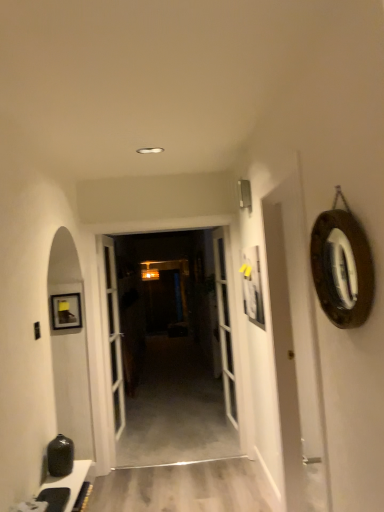
The width and height of the screenshot is (384, 512). Describe the element at coordinates (342, 268) in the screenshot. I see `wooden-framed mirror at right` at that location.

Describe the element at coordinates (70, 481) in the screenshot. I see `matte black cabinet at lower left` at that location.

Find the location of a particular element. wooden at center is located at coordinates (173, 347).

Which object is further away from the camera, white glass door at center, the first door viewed from the right, or wooden-framed mirror at right?

Positioned behind is white glass door at center, the first door viewed from the right.

From a real-world perspective, between white glass door at center, the first door viewed from the right, and wooden-framed mirror at right, who is vertically higher?

wooden-framed mirror at right.

Which of these two, white glass door at center, the first door viewed from the right, or wooden-framed mirror at right, is wider?

white glass door at center, the first door viewed from the right, is wider.

Would you say wooden-framed mirror at right is part of white glass door at center, the first door viewed from the right,'s contents?

Definitely not — wooden-framed mirror at right is not inside white glass door at center, the first door viewed from the right.

Does wooden-framed mirror at right have a greater width compared to white glass door at center, acting as the second door starting from the left?

No.

Is wooden-framed mirror at right smaller than white glass door at center, acting as the second door starting from the left?

Yes, wooden-framed mirror at right is smaller than white glass door at center, acting as the second door starting from the left.

Who is taller, wooden-framed mirror at right or white glass door at center, the first door viewed from the right?

With more height is white glass door at center, the first door viewed from the right.

From the image's perspective, is wooden-framed mirror at right on top of white glass door at center, the first door viewed from the right?

Yes, from the image's perspective, wooden-framed mirror at right is over white glass door at center, the first door viewed from the right.

Is matte black cabinet at lower left next to wooden-framed mirror at right?

There is a gap between matte black cabinet at lower left and wooden-framed mirror at right.

Is matte black cabinet at lower left inside the boundaries of wooden-framed mirror at right, or outside?

matte black cabinet at lower left is located beyond the bounds of wooden-framed mirror at right.

From the picture: Who is bigger, matte black cabinet at lower left or wooden-framed mirror at right?

Bigger between the two is wooden-framed mirror at right.

Is matte black cabinet at lower left facing towards wooden-framed mirror at right?

No, matte black cabinet at lower left is not oriented towards wooden-framed mirror at right.

Can white glass door at center, the first door viewed from the right, be found inside wooden at center?

No, white glass door at center, the first door viewed from the right, is not a part of wooden at center.

From the image's perspective, is wooden at center under white glass door at center, the first door viewed from the right?

Yes.

Can you tell me how much wooden at center and white glass door at center, the first door viewed from the right, differ in facing direction?

They differ by 0.00151 degrees in their facing directions.

Between wooden at center and white glass door at center, acting as the second door starting from the left, which one has smaller size?

Smaller between the two is wooden at center.

From a real-world perspective, which is physically above, wooden at center or wooden-framed mirror at right?

wooden-framed mirror at right.

In the image, is wooden at center positioned in front of or behind wooden-framed mirror at right?

wooden at center is positioned farther from the viewer than wooden-framed mirror at right.

In the scene shown: In terms of width, does wooden at center look wider or thinner when compared to wooden-framed mirror at right?

Considering their sizes, wooden at center looks slimmer than wooden-framed mirror at right.

From a real-world perspective, is white glass door at center, acting as the second door starting from the left, physically located above or below matte black cabinet at lower left?

white glass door at center, acting as the second door starting from the left, is above matte black cabinet at lower left.

Consider the image. Choose the correct answer: Is white glass door at center, the first door viewed from the right, inside matte black cabinet at lower left or outside it?

white glass door at center, the first door viewed from the right, exists outside the volume of matte black cabinet at lower left.

Based on the photo, considering the sizes of objects white glass door at center, acting as the second door starting from the left, and matte black cabinet at lower left in the image provided, who is thinner, white glass door at center, acting as the second door starting from the left, or matte black cabinet at lower left?

With smaller width is matte black cabinet at lower left.

Considering the points (227, 361) and (80, 487), which point is in front, point (227, 361) or point (80, 487)?

Positioned in front is point (80, 487).

Based on the photo, is wooden-framed mirror at right not near wooden at center?

Yes, wooden-framed mirror at right and wooden at center are located far from each other.

Between wooden-framed mirror at right and wooden at center, which one has less height?

wooden-framed mirror at right is shorter.

Is wooden-framed mirror at right in front of or behind wooden at center in the image?

In the image, wooden-framed mirror at right appears in front of wooden at center.

Choose the correct answer: Is wooden-framed mirror at right inside wooden at center or outside it?

wooden-framed mirror at right is spatially situated outside wooden at center.

At what (x,y) coordinates should I click in order to perform the action: click on the 2nd door behind the wooden-framed mirror at right. Please return your answer as a coordinate pair (x, y). Looking at the image, I should click on (225, 321).

I want to click on the 2nd door below the wooden-framed mirror at right (from a real-world perspective), so click(225, 321).

Looking at the image, which one is located closer to matte black cabinet at lower left, wooden at center or wooden-framed mirror at right?

wooden-framed mirror at right.

Based on their spatial positions, is wooden at center or white glossy door at center, arranged as the first door when viewed from the left, closer to matte black cabinet at lower left?

Result: Based on the image, white glossy door at center, arranged as the first door when viewed from the left, appears to be nearer to matte black cabinet at lower left.

Based on their spatial positions, is white glossy door at center, positioned as the 2th door in right-to-left order, or white glass door at center, the first door viewed from the right, closer to wooden-framed mirror at right?

Based on the image, white glossy door at center, positioned as the 2th door in right-to-left order, appears to be nearer to wooden-framed mirror at right.

Looking at the image, which one is located closer to matte black cabinet at lower left, white glossy door at center, arranged as the first door when viewed from the left, or wooden-framed mirror at right?

The object closer to matte black cabinet at lower left is wooden-framed mirror at right.

Considering their positions, is wooden at center positioned further to matte black cabinet at lower left than white glass door at center, acting as the second door starting from the left?

wooden at center is positioned further to the anchor matte black cabinet at lower left.

When comparing their distances from white glossy door at center, positioned as the 2th door in right-to-left order, does wooden-framed mirror at right or white glass door at center, the first door viewed from the right, seem further?

wooden-framed mirror at right.

In the scene shown: Estimate the real-world distances between objects in this image. Which object is closer to wooden at center, white glass door at center, acting as the second door starting from the left, or wooden-framed mirror at right?

Among the two, white glass door at center, acting as the second door starting from the left, is located nearer to wooden at center.

Looking at the image, which one is located further to white glass door at center, the first door viewed from the right, white glossy door at center, positioned as the 2th door in right-to-left order, or wooden at center?

wooden at center.

Identify the location of cabinetry positioned between wooden-framed mirror at right and wooden at center from near to far. (70, 481).

You are a GUI agent. You are given a task and a screenshot of the screen. Output one action in this format:
    pyautogui.click(x=<x>, y=<y>)
    Task: Click on the door between matte black cabinet at lower left and wooden at center in the front-back direction
    This screenshot has width=384, height=512.
    Given the screenshot: What is the action you would take?
    pyautogui.click(x=113, y=334)

This screenshot has height=512, width=384. What are the coordinates of `garage door between white glossy door at center, arranged as the first door when viewed from the left, and white glass door at center, the first door viewed from the right` in the screenshot? It's located at (173, 347).

What are the coordinates of `door between matte black cabinet at lower left and white glass door at center, acting as the second door starting from the left, in the front-back direction` in the screenshot? It's located at (113, 334).